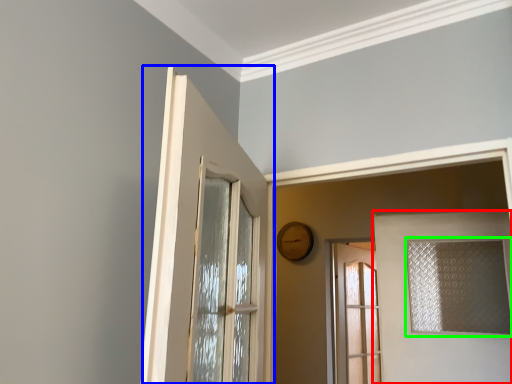
Question: Estimate the real-world distances between objects in this image. Which object is closer to door (highlighted by a red box), door (highlighted by a blue box) or window (highlighted by a green box)?

Choices:
 (A) door
 (B) window

Answer: (B)